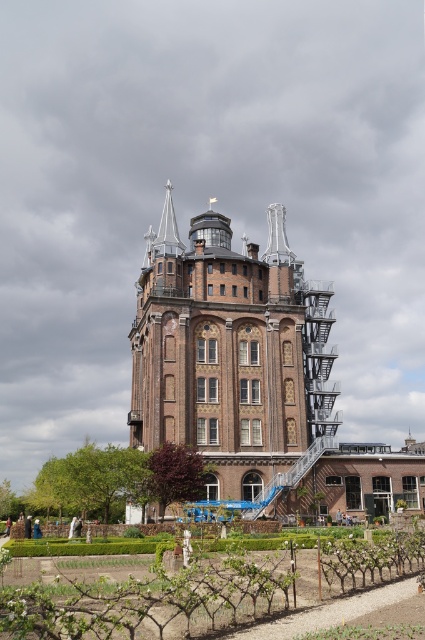
Describe the element at coordinates (232, 356) in the screenshot. The image size is (425, 640). I see `brown brick tower at center` at that location.

Does brown brick tower at center appear on the right side of green leafy vines at lower center?

Correct, you'll find brown brick tower at center to the right of green leafy vines at lower center.

Describe the element at coordinates (232, 356) in the screenshot. I see `brown brick tower at center` at that location.

Locate an element on the screen. Image resolution: width=425 pixels, height=640 pixels. brown brick tower at center is located at coordinates (232, 356).